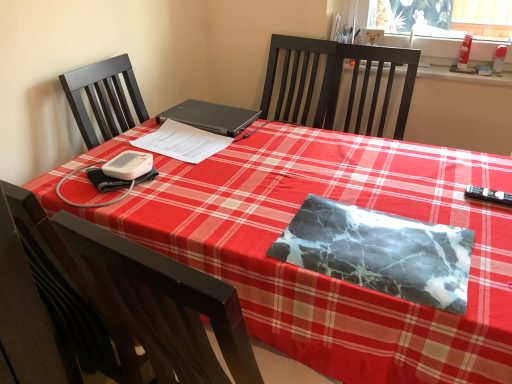
What are the coordinates of `vacant space situated above black matte laptop at center (from a real-world perspective)` in the screenshot? It's located at (202, 109).